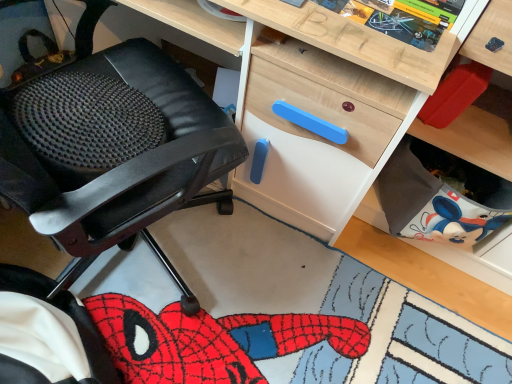
Question: Is matte black office chair at left bigger than wooden comic book at upper center?

Choices:
 (A) yes
 (B) no

Answer: (A)

Question: From a real-world perspective, is matte black office chair at left located higher than wooden comic book at upper center?

Choices:
 (A) yes
 (B) no

Answer: (B)

Question: Does matte black office chair at left appear on the left side of wooden comic book at upper center?

Choices:
 (A) no
 (B) yes

Answer: (B)

Question: Can you confirm if matte black office chair at left is positioned to the right of wooden comic book at upper center?

Choices:
 (A) yes
 (B) no

Answer: (B)

Question: Does matte black office chair at left lie in front of wooden comic book at upper center?

Choices:
 (A) yes
 (B) no

Answer: (A)

Question: Can we say matte black office chair at left lies outside wooden comic book at upper center?

Choices:
 (A) yes
 (B) no

Answer: (A)

Question: From the image's perspective, is wooden comic book at upper center over matte black office chair at left?

Choices:
 (A) no
 (B) yes

Answer: (B)

Question: Is wooden comic book at upper center outside matte black office chair at left?

Choices:
 (A) yes
 (B) no

Answer: (A)

Question: Can you confirm if wooden comic book at upper center is wider than matte black office chair at left?

Choices:
 (A) yes
 (B) no

Answer: (B)

Question: Is wooden comic book at upper center oriented away from matte black office chair at left?

Choices:
 (A) no
 (B) yes

Answer: (A)

Question: Is wooden comic book at upper center touching matte black office chair at left?

Choices:
 (A) yes
 (B) no

Answer: (B)

Question: Does wooden comic book at upper center turn towards matte black office chair at left?

Choices:
 (A) no
 (B) yes

Answer: (B)

Question: Would you say matte black office chair at left is to the left or to the right of wooden comic book at upper center in the picture?

Choices:
 (A) left
 (B) right

Answer: (A)